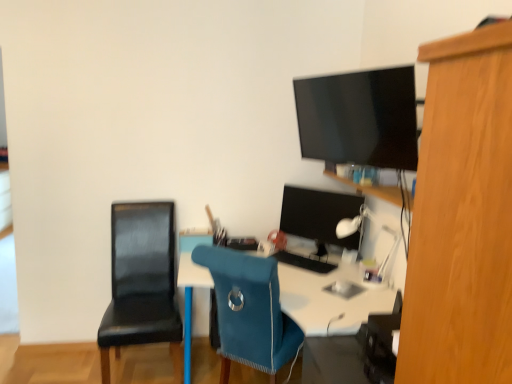
Question: Which direction should I rotate to look at blue fabric chair at center, which is counted as the first chair, starting from the right?

Choices:
 (A) left
 (B) right

Answer: (B)

Question: Is white plastic lamp at upper right beside white glossy desk at center?

Choices:
 (A) yes
 (B) no

Answer: (B)

Question: From a real-world perspective, is white plastic lamp at upper right on white glossy desk at center?

Choices:
 (A) yes
 (B) no

Answer: (A)

Question: Would you say white plastic lamp at upper right is a long distance from white glossy desk at center?

Choices:
 (A) yes
 (B) no

Answer: (B)

Question: Is white plastic lamp at upper right looking in the opposite direction of white glossy desk at center?

Choices:
 (A) yes
 (B) no

Answer: (B)

Question: From the image's perspective, does white plastic lamp at upper right appear higher than white glossy desk at center?

Choices:
 (A) yes
 (B) no

Answer: (A)

Question: Considering the relative positions of white plastic lamp at upper right and white glossy desk at center in the image provided, is white plastic lamp at upper right in front of white glossy desk at center?

Choices:
 (A) no
 (B) yes

Answer: (A)

Question: Is blue fabric chair at center, which is counted as the first chair, starting from the right, oriented away from matte black monitor at center?

Choices:
 (A) yes
 (B) no

Answer: (B)

Question: Is blue fabric chair at center, the second chair in the left-to-right sequence, not within matte black monitor at center?

Choices:
 (A) yes
 (B) no

Answer: (A)

Question: From a real-world perspective, is blue fabric chair at center, the second chair in the left-to-right sequence, located beneath matte black monitor at center?

Choices:
 (A) yes
 (B) no

Answer: (A)

Question: Is blue fabric chair at center, which is counted as the first chair, starting from the right, wider than matte black monitor at center?

Choices:
 (A) yes
 (B) no

Answer: (A)

Question: Is blue fabric chair at center, which is counted as the first chair, starting from the right, next to matte black monitor at center and touching it?

Choices:
 (A) no
 (B) yes

Answer: (A)

Question: Would you say blue fabric chair at center, the second chair in the left-to-right sequence, contains matte black monitor at center?

Choices:
 (A) no
 (B) yes

Answer: (A)

Question: Can you confirm if black leather chair at left, acting as the first chair starting from the left, is positioned to the left of black matte keyboard at center?

Choices:
 (A) yes
 (B) no

Answer: (A)